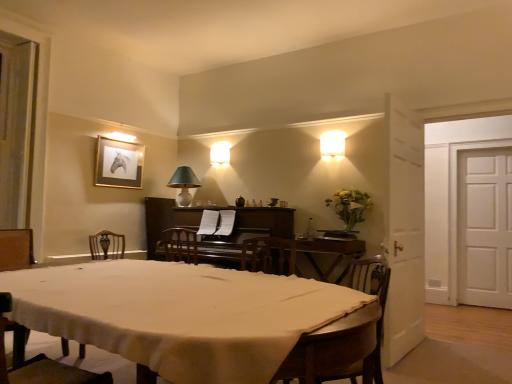
Question: Which direction should I rotate to look at matte green lampshade at upper center, which ranks as the 3th lamp in front-to-back order?

Choices:
 (A) right
 (B) left

Answer: (B)

Question: Does matte white lampshade at center, the second lamp in the front-to-back sequence, have a greater height compared to dark brown polished wood piano at center?

Choices:
 (A) no
 (B) yes

Answer: (A)

Question: Is dark brown polished wood piano at center located within matte white lampshade at center, the 1th lamp viewed from the left?

Choices:
 (A) no
 (B) yes

Answer: (A)

Question: Is matte white lampshade at center, the third lamp positioned from the right, placed right next to dark brown polished wood piano at center?

Choices:
 (A) no
 (B) yes

Answer: (A)

Question: Is the position of matte white lampshade at center, the third lamp positioned from the right, less distant than that of dark brown polished wood piano at center?

Choices:
 (A) yes
 (B) no

Answer: (B)

Question: Can you confirm if matte white lampshade at center, the second lamp in the front-to-back sequence, is smaller than dark brown polished wood piano at center?

Choices:
 (A) no
 (B) yes

Answer: (B)

Question: Does matte white lampshade at center, the 2th lamp viewed from the back, turn towards dark brown polished wood piano at center?

Choices:
 (A) no
 (B) yes

Answer: (A)

Question: Is dark brown polished wood piano at center surrounded by wooden striped chair at lower right, the 1th chair from the back?

Choices:
 (A) yes
 (B) no

Answer: (B)

Question: From a real-world perspective, does wooden striped chair at lower right, the 1th chair from the back, stand above dark brown polished wood piano at center?

Choices:
 (A) yes
 (B) no

Answer: (B)

Question: Is wooden striped chair at lower right, the first chair in the right-to-left sequence, closer to camera compared to dark brown polished wood piano at center?

Choices:
 (A) no
 (B) yes

Answer: (B)

Question: Does wooden striped chair at lower right, the 1th chair from the back, appear on the left side of dark brown polished wood piano at center?

Choices:
 (A) no
 (B) yes

Answer: (A)

Question: From the image's perspective, would you say wooden striped chair at lower right, the 1th chair from the back, is positioned over dark brown polished wood piano at center?

Choices:
 (A) yes
 (B) no

Answer: (B)

Question: Does wooden striped chair at lower right, the 1th chair from the back, turn towards dark brown polished wood piano at center?

Choices:
 (A) yes
 (B) no

Answer: (B)

Question: Does matte green lampshade at upper center, arranged as the second lamp when viewed from the left, lie behind wooden striped chair at lower right, the first chair in the right-to-left sequence?

Choices:
 (A) no
 (B) yes

Answer: (B)